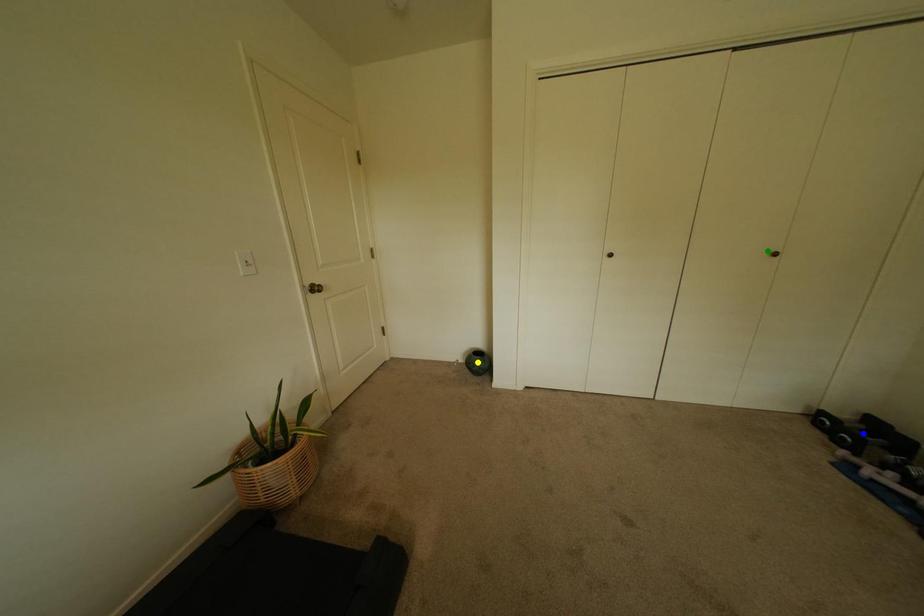
Order these from nearest to farthest:
1. blue point
2. yellow point
3. green point

blue point
green point
yellow point